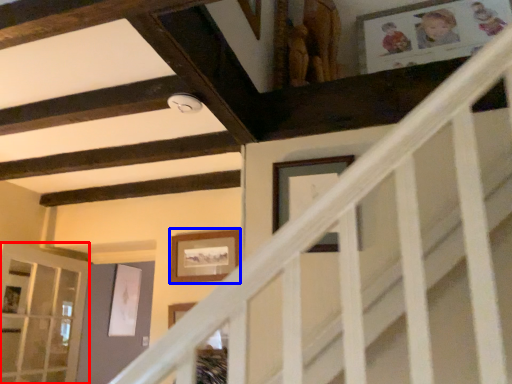
Question: Which point is closer to the camera, glass door (highlighted by a red box) or picture frame (highlighted by a blue box)?

Choices:
 (A) glass door
 (B) picture frame

Answer: (A)